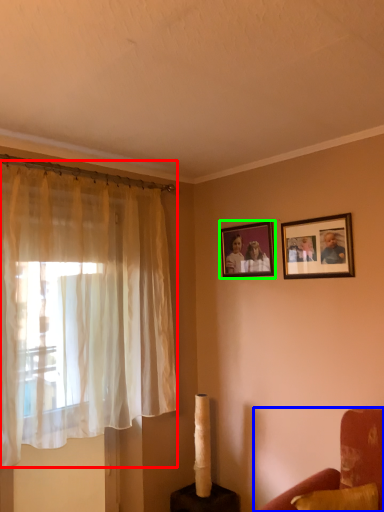
Question: Estimate the real-world distances between objects in this image. Which object is farther from curtain (highlighted by a red box), furniture (highlighted by a blue box) or picture frame (highlighted by a green box)?

Choices:
 (A) furniture
 (B) picture frame

Answer: (A)